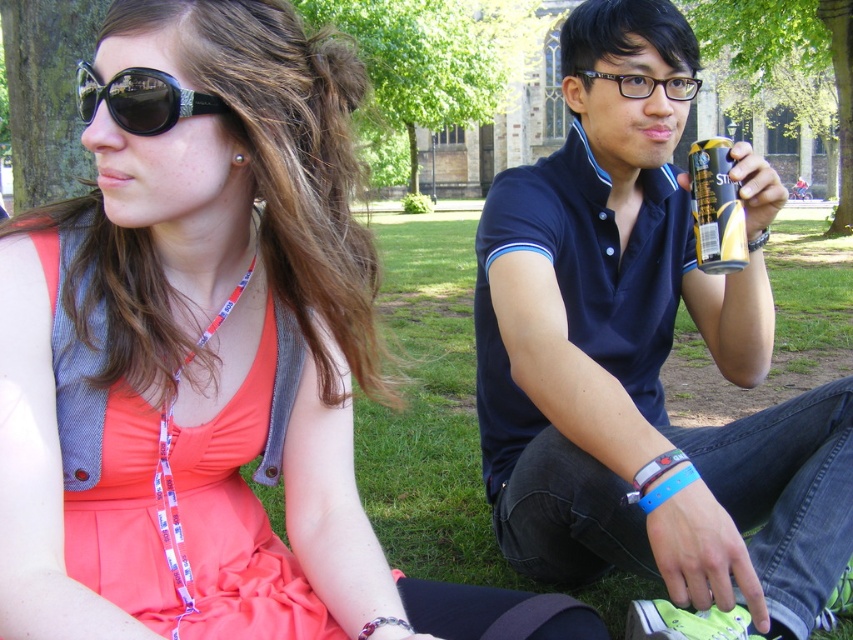
You are a photographer trying to capture a closeup shot of the black shiny sunglasses at upper left and the black matte can at upper right. Which object should you focus on first if you want to ensure both are in focus without moving the camera?

The black shiny sunglasses at upper left should be focused on first since it is closer to the camera than the black matte can at upper right, allowing both to be in focus by using the hyperfocal distance technique.

You are a photographer trying to capture a closeup of the blue fabric polo shirt at center and the black shiny sunglasses at upper left. Which object should you focus on first if you want to ensure both are in focus without adjusting the camera settings?

The blue fabric polo shirt at center is positioned on the right side of black shiny sunglasses at upper left, so focusing on the black shiny sunglasses at upper left first would allow both to be in focus since they are closer to the camera.

You are a delivery robot with a 15 cm wide package. You need to place it on the surface between the black shiny sunglasses at upper left and the black matte can at upper right. Can the package fit in that space?

The black shiny sunglasses at upper left might be wider than the black matte can at upper right, so the space between them may not be wide enough for a 15 cm package. Check the actual width before placing the package.